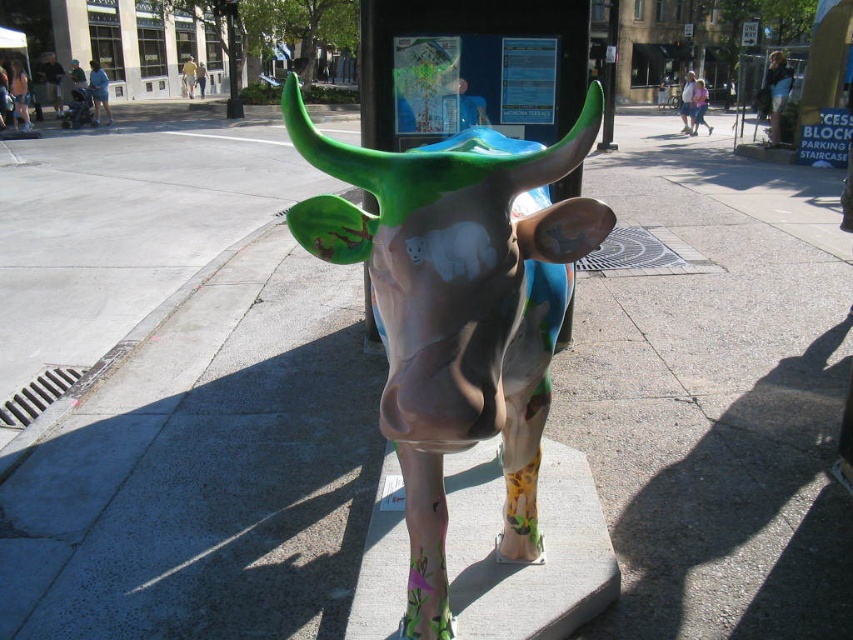
You are an artist planning to install a new sculpture in the city. You have two options for the bull sculpture, the painted ceramic cow at center and the matte plastic cow at center. If you want to choose the taller one for visibility, which one should you select?

The painted ceramic cow at center has a greater height compared to the matte plastic cow at center, so you should select the painted ceramic cow at center for better visibility.

You are an art curator planning to display both the painted ceramic cow at center and the matte plastic cow at center in a gallery. If you want to place them side by side, which one should be placed first to maintain visual balance?

The painted ceramic cow at center is bigger than the matte plastic cow at center, so to maintain visual balance, the larger painted ceramic cow at center should be placed first, followed by the smaller matte plastic cow at center.

You are a photographer standing at the sidewalk. You want to take a photo of the painted ceramic cow at center. If your camera can focus on objects up to 4 feet away, will it be able to capture the cow clearly?

The painted ceramic cow at center is 3.64 feet away from the camera. Since 3.64 feet is less than 4 feet, the camera can focus on the cow and capture it clearly.